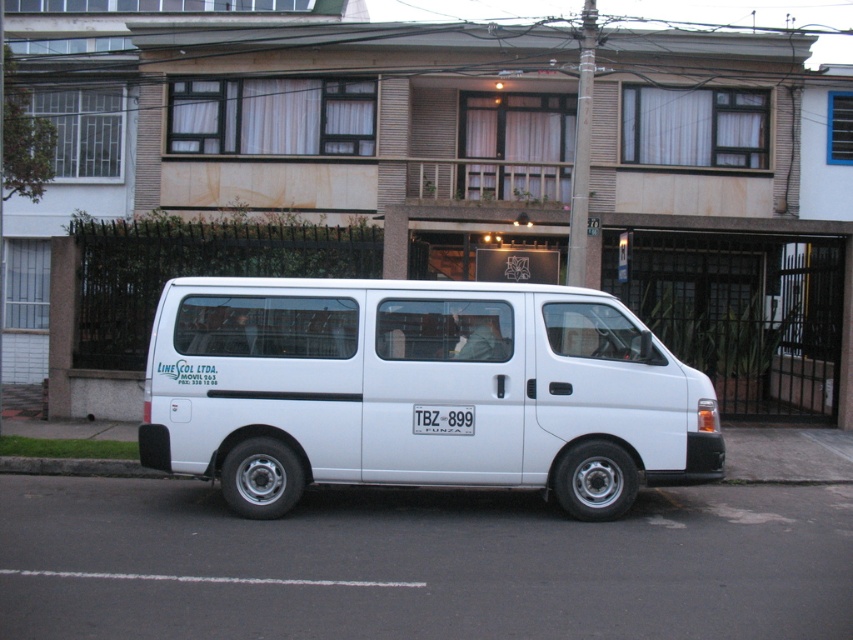
Looking at this image, between white matte van at center and white plastic license plate at center, which one appears on the right side from the viewer's perspective?

white plastic license plate at center

Between white matte van at center and white plastic license plate at center, which one has less height?

With less height is white plastic license plate at center.

Locate an element on the screen. white matte van at center is located at coordinates (416, 392).

Identify the location of white matte van at center. (416, 392).